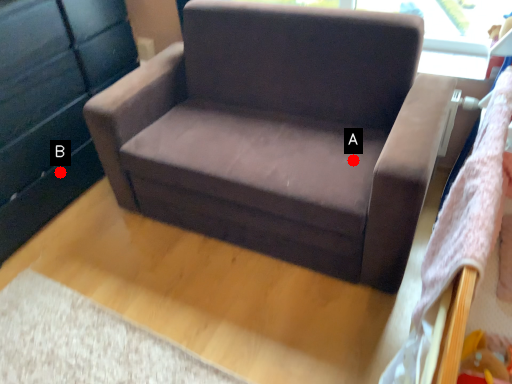
Question: Two points are circled on the image, labeled by A and B beside each circle. Which point is closer to the camera?

Choices:
 (A) A is closer
 (B) B is closer

Answer: (A)